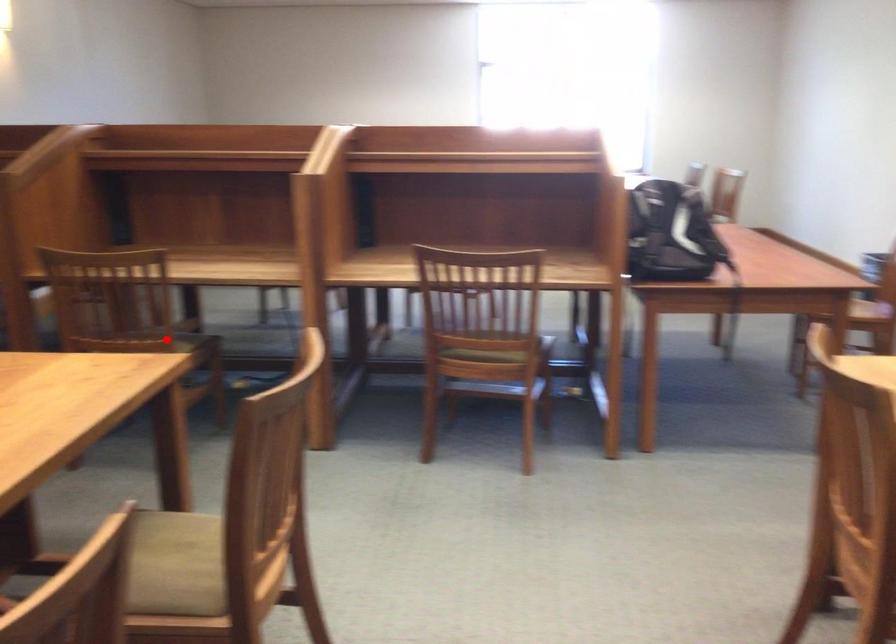
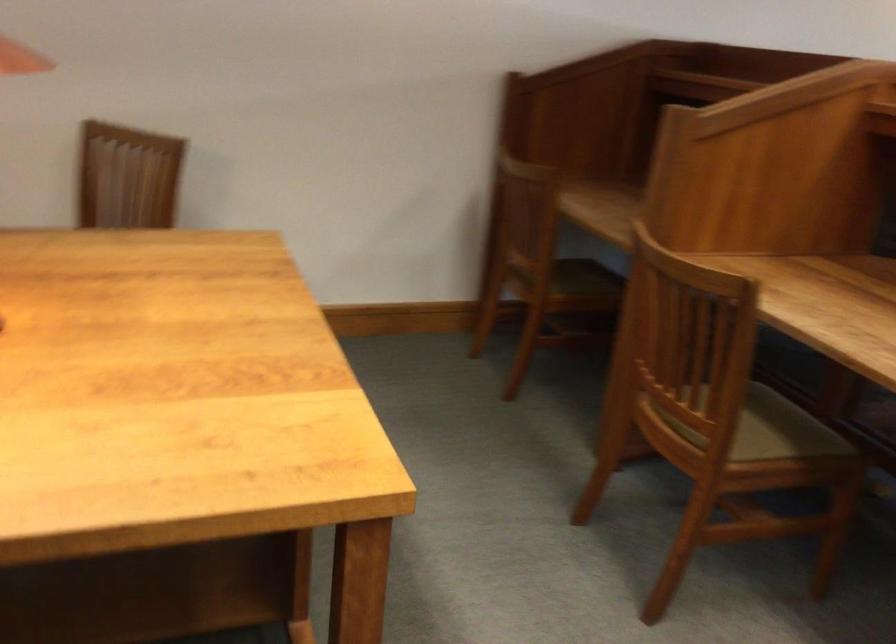
Locate, in the second image, the point that corresponds to the highlighted location in the first image.

(765, 428)